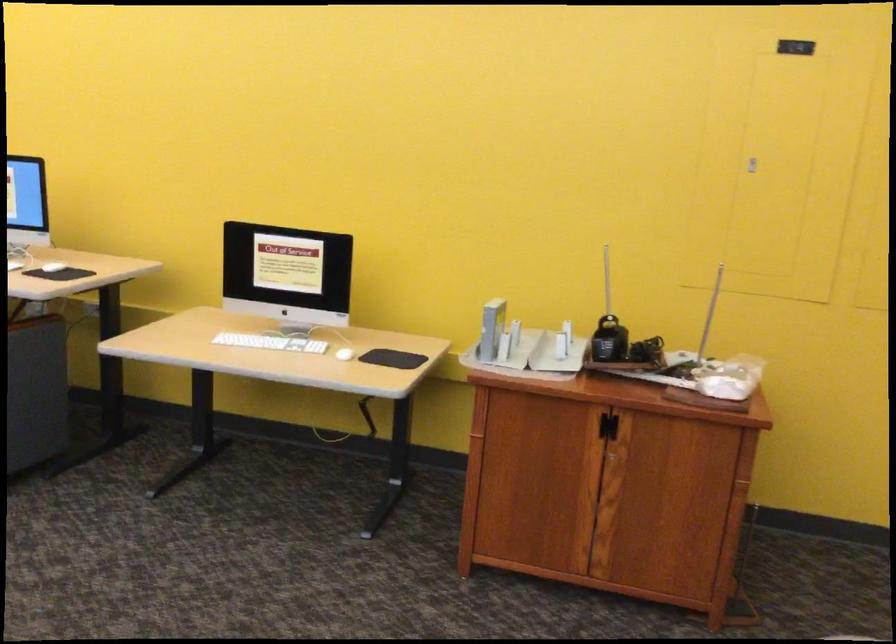
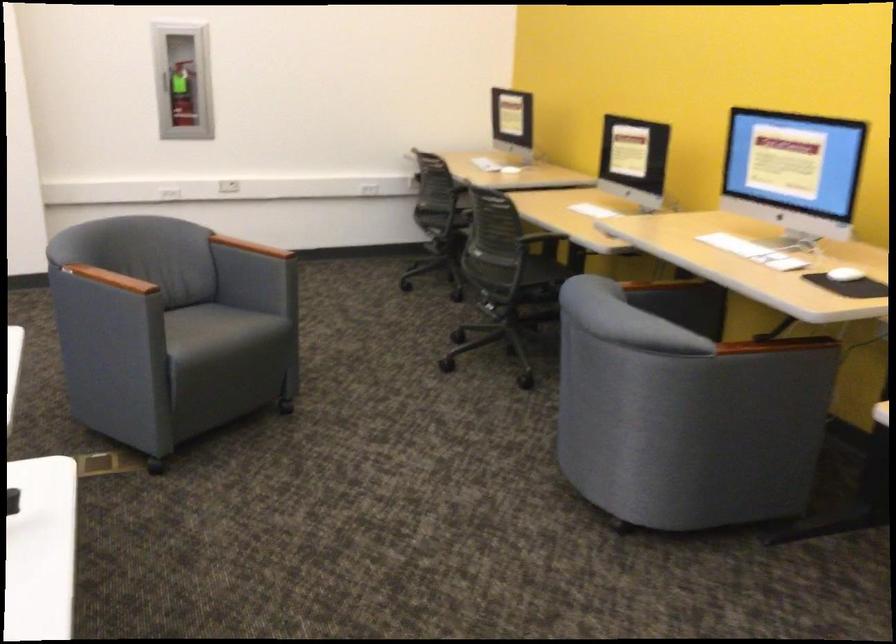
Question: The camera is either moving clockwise (left) or counter-clockwise (right) around the object. The first image is from the beginning of the video and the second image is from the end. Is the camera moving left or right when shooting the video?

Choices:
 (A) Left
 (B) Right

Answer: (B)